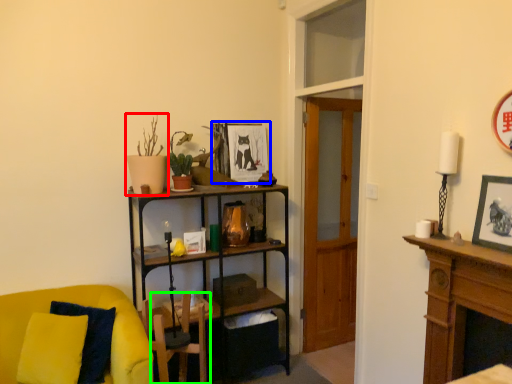
Question: Based on their relative distances, which object is farther from houseplant (highlighted by a red box)? Choose from picture frame (highlighted by a blue box) and swivel chair (highlighted by a green box).

Choices:
 (A) picture frame
 (B) swivel chair

Answer: (B)